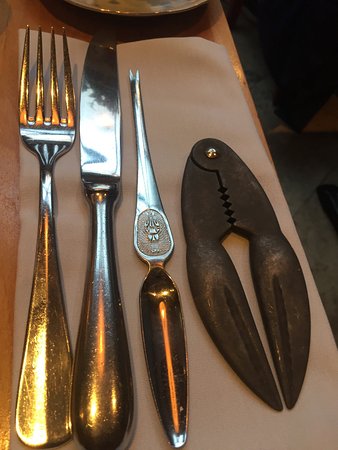
Find the location of `handle where fork would be held`. handle where fork would be held is located at coordinates (44, 376).